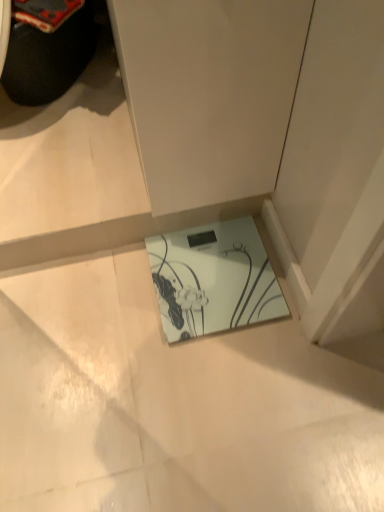
Image resolution: width=384 pixels, height=512 pixels. In order to click on free space above white glossy scale at center (from a real-world perspective) in this screenshot , I will do `click(212, 272)`.